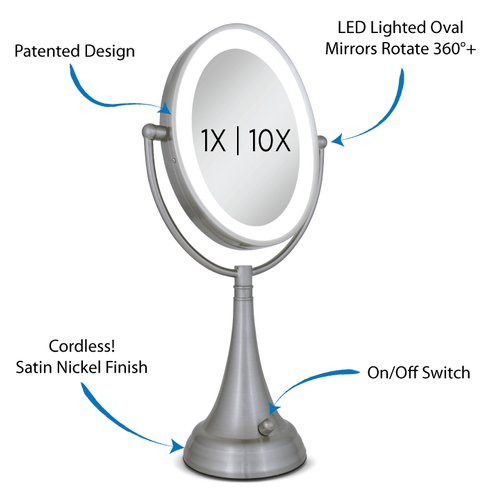
Locate an element on the screen. black text that says "led lighted oval mirros rotate 360 degrees +" is located at coordinates (390, 38).